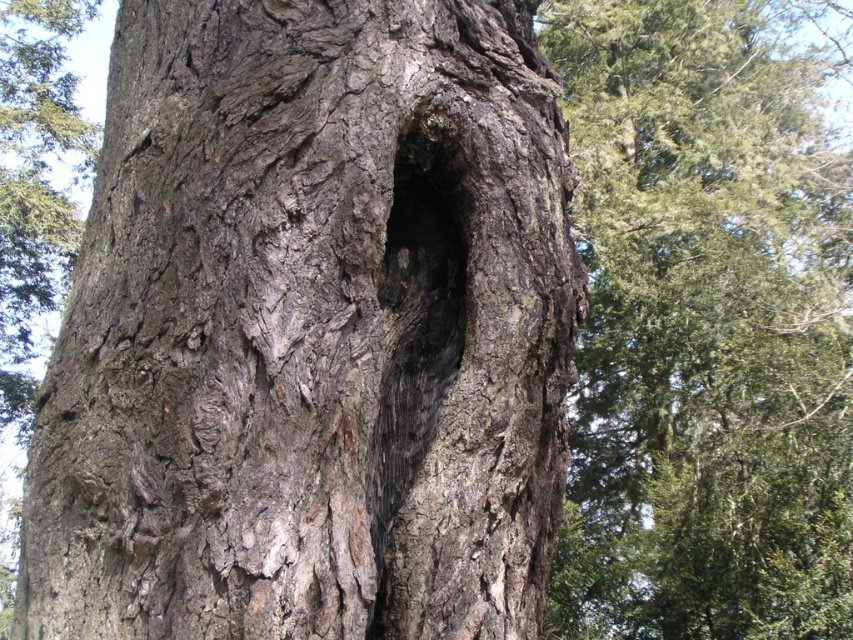
Question: Which point appears farthest from the camera in this image?

Choices:
 (A) (804, 132)
 (B) (402, 124)

Answer: (A)

Question: Estimate the real-world distances between objects in this image. Which object is closer to the smooth bark tree trunk at center?

Choices:
 (A) dark wood hole at center
 (B) dark gray rough bark at center

Answer: (B)

Question: Where is dark gray rough bark at center located in relation to smooth bark tree trunk at center in the image?

Choices:
 (A) below
 (B) above

Answer: (A)

Question: Is dark gray rough bark at center positioned before smooth bark tree trunk at center?

Choices:
 (A) yes
 (B) no

Answer: (A)

Question: Which point is farther to the camera?

Choices:
 (A) (838, 605)
 (B) (440, 236)

Answer: (A)

Question: Is dark gray rough bark at center to the right of smooth bark tree trunk at center from the viewer's perspective?

Choices:
 (A) no
 (B) yes

Answer: (A)